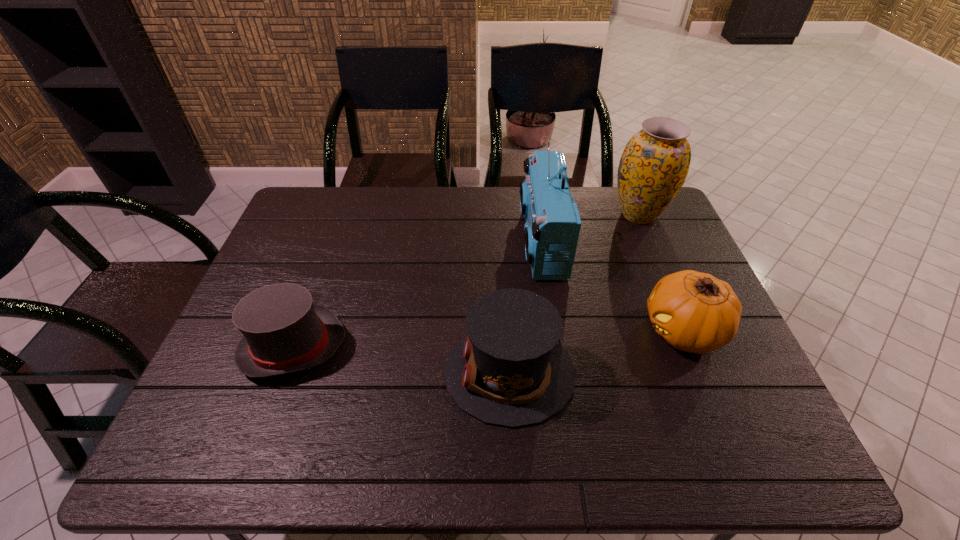
The image size is (960, 540). Identify the location of vase. (653, 167).

Identify the location of radio receiver. The height and width of the screenshot is (540, 960). (552, 228).

I want to click on pumpkin, so click(x=695, y=312).

Find the location of a particular element. This screenshot has height=540, width=960. the taller dress hat is located at coordinates pos(509,370).

Where is `the shorter dress hat`? Image resolution: width=960 pixels, height=540 pixels. the shorter dress hat is located at coordinates (283, 332).

Where is `the left dress hat`? the left dress hat is located at coordinates (283, 332).

The image size is (960, 540). I want to click on vacant space located on the front of the vase, so click(x=660, y=264).

The width and height of the screenshot is (960, 540). I want to click on free space located on the front-facing side of the radio receiver, so click(x=489, y=242).

The image size is (960, 540). Identify the location of free space located on the front-facing side of the radio receiver. (489, 242).

Where is `vacant space situated on the front-facing side of the radio receiver`? vacant space situated on the front-facing side of the radio receiver is located at coordinates (431, 242).